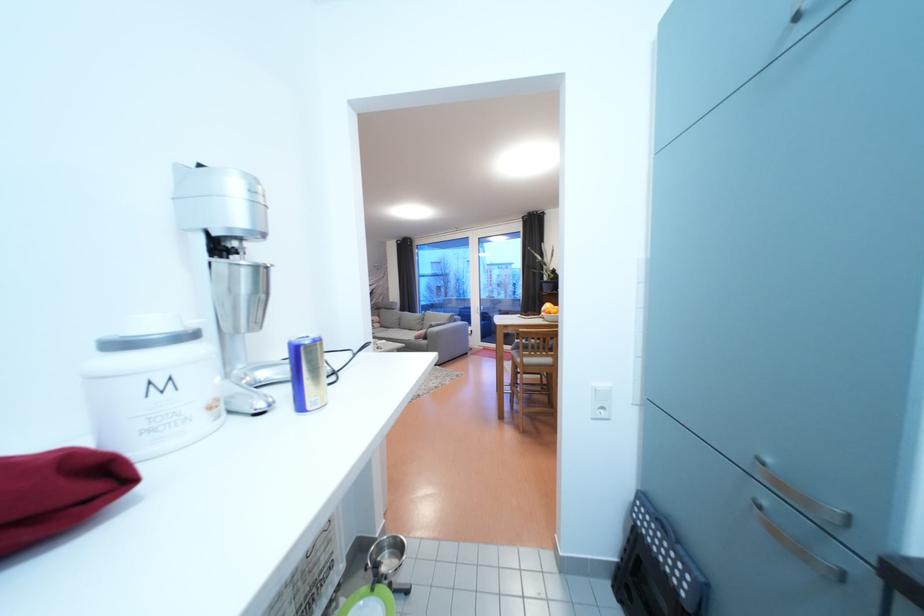
The location [398,588] corresponds to which object?

It corresponds to the metal scoop in the image.